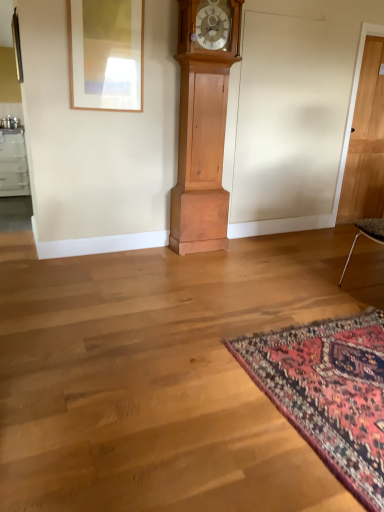
Locate an element on the screen. The height and width of the screenshot is (512, 384). free space in front of light brown wood grandfather clock at center is located at coordinates (208, 260).